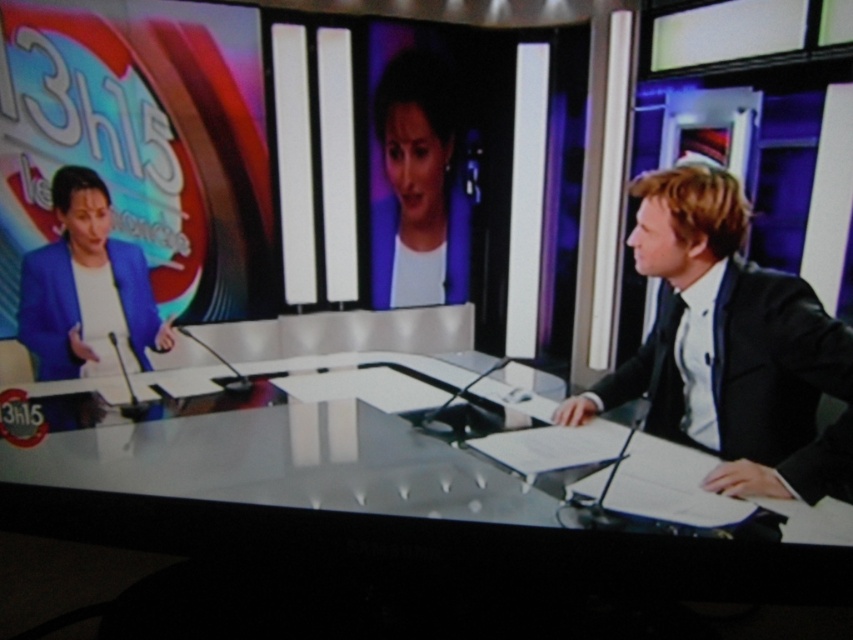
Does black glossy suit at right have a lesser height compared to matte white shirt at center?

Incorrect, black glossy suit at right's height does not fall short of matte white shirt at center's.

Can you confirm if black glossy suit at right is positioned to the right of matte white shirt at center?

Indeed, black glossy suit at right is positioned on the right side of matte white shirt at center.

Is point (689, 348) positioned in front of point (440, 113)?

That is False.

This screenshot has width=853, height=640. In order to click on black glossy suit at right in this screenshot , I will do `click(730, 348)`.

Which is more to the left, matte white shirt at center or matte blue suit at left?

Positioned to the left is matte blue suit at left.

In the scene shown: Is matte white shirt at center above matte blue suit at left?

Yes.

At what (x,y) coordinates should I click in order to perform the action: click on matte white shirt at center. Please return your answer as a coordinate pair (x, y). This screenshot has width=853, height=640. Looking at the image, I should click on (418, 188).

Is white glossy table at center positioned behind matte white shirt at center?

No.

Who is more distant from viewer, (323, 483) or (456, 236)?

Positioned behind is point (323, 483).

The height and width of the screenshot is (640, 853). I want to click on white glossy table at center, so click(373, 525).